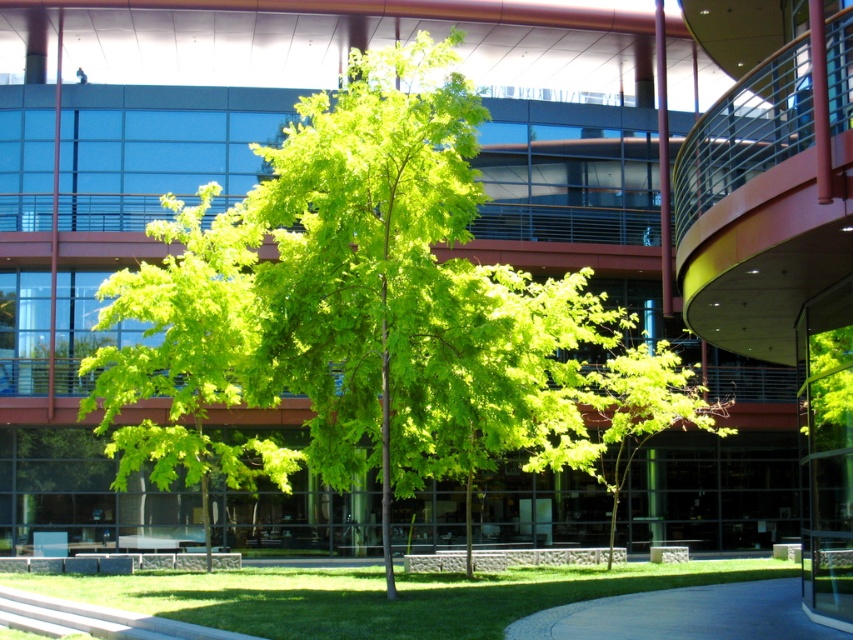
Who is shorter, green grass at lower center or concrete pavement at lower center?

concrete pavement at lower center is shorter.

Does point (265, 618) come closer to viewer compared to point (631, 621)?

No, it is not.

Where is `green grass at lower center`? The width and height of the screenshot is (853, 640). green grass at lower center is located at coordinates (379, 595).

Is green leafy tree at center to the right of concrete pavement at lower center from the viewer's perspective?

No, green leafy tree at center is not to the right of concrete pavement at lower center.

Can you confirm if green leafy tree at center is positioned below concrete pavement at lower center?

Incorrect, green leafy tree at center is not positioned below concrete pavement at lower center.

Is point (262, 442) closer to camera compared to point (567, 612)?

That is False.

You are a GUI agent. You are given a task and a screenshot of the screen. Output one action in this format:
    pyautogui.click(x=<x>, y=<y>)
    Task: Click on the green leafy tree at center
    This screenshot has width=853, height=640.
    Given the screenshot: What is the action you would take?
    pyautogui.click(x=186, y=355)

Does green leafy tree at center have a greater width compared to green grass at lower center?

No.

Does green leafy tree at center come behind green grass at lower center?

Yes.

Who is more forward, (131, 440) or (334, 586)?

Point (334, 586) is more forward.

The height and width of the screenshot is (640, 853). I want to click on green leafy tree at center, so click(x=186, y=355).